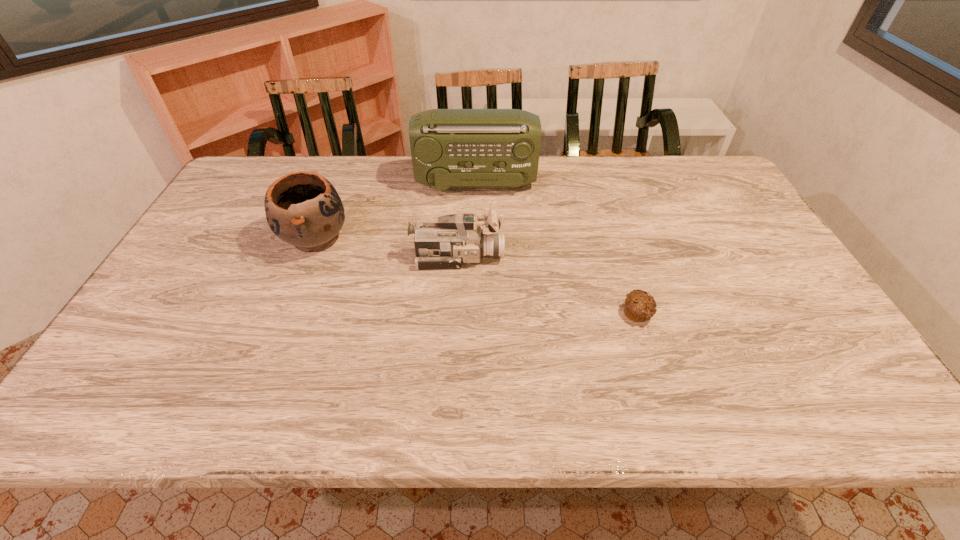
Identify the location of the farthest object. This screenshot has width=960, height=540. (450, 148).

I want to click on the tallest object, so [450, 148].

At what (x,y) coordinates should I click in order to perform the action: click on pottery. Please return your answer as a coordinate pair (x, y). Image resolution: width=960 pixels, height=540 pixels. Looking at the image, I should click on (303, 209).

The height and width of the screenshot is (540, 960). I want to click on camcorder, so click(x=456, y=239).

Where is `the shortest object`? the shortest object is located at coordinates [640, 306].

Find the location of `muffin`. muffin is located at coordinates (640, 306).

I want to click on vacant space located 0.080m on the front-facing side of the radio_receiver, so click(559, 184).

At what (x,y) coordinates should I click in order to perform the action: click on vacant space situated 0.100m on the right of the leftmost object. Please return your answer as a coordinate pair (x, y). The width and height of the screenshot is (960, 540). Looking at the image, I should click on (385, 239).

Locate an element on the screen. vacant space situated on the front-facing side of the camcorder is located at coordinates (547, 257).

The width and height of the screenshot is (960, 540). Identify the location of vacant area situated on the back of the shortest object. (613, 238).